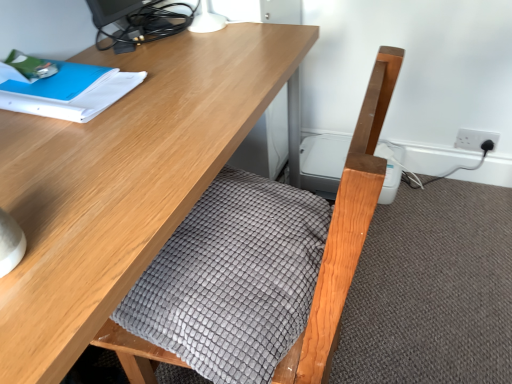
Question: From a real-world perspective, is white plastic socket at upper right on gray textured blanket at center?

Choices:
 (A) no
 (B) yes

Answer: (A)

Question: Is white plastic socket at upper right facing away from gray textured blanket at center?

Choices:
 (A) yes
 (B) no

Answer: (B)

Question: Does white plastic socket at upper right come in front of gray textured blanket at center?

Choices:
 (A) no
 (B) yes

Answer: (A)

Question: From the image's perspective, is white plastic socket at upper right located beneath gray textured blanket at center?

Choices:
 (A) yes
 (B) no

Answer: (B)

Question: Would you say white plastic socket at upper right contains gray textured blanket at center?

Choices:
 (A) yes
 (B) no

Answer: (B)

Question: Considering the relative sizes of white plastic socket at upper right and gray textured blanket at center in the image provided, is white plastic socket at upper right shorter than gray textured blanket at center?

Choices:
 (A) no
 (B) yes

Answer: (B)

Question: Is wooden desk at center at the left side of gray textured blanket at center?

Choices:
 (A) yes
 (B) no

Answer: (A)

Question: Is there a large distance between wooden desk at center and gray textured blanket at center?

Choices:
 (A) no
 (B) yes

Answer: (A)

Question: Is wooden desk at center wider than gray textured blanket at center?

Choices:
 (A) no
 (B) yes

Answer: (B)

Question: Is wooden desk at center closer to the viewer compared to gray textured blanket at center?

Choices:
 (A) no
 (B) yes

Answer: (B)

Question: Is wooden desk at center outside of gray textured blanket at center?

Choices:
 (A) no
 (B) yes

Answer: (B)

Question: Would you say gray textured blanket at center is part of wooden desk at center's contents?

Choices:
 (A) no
 (B) yes

Answer: (B)

Question: Is blue paper at upper left not within matte black monitor at upper left?

Choices:
 (A) no
 (B) yes

Answer: (B)